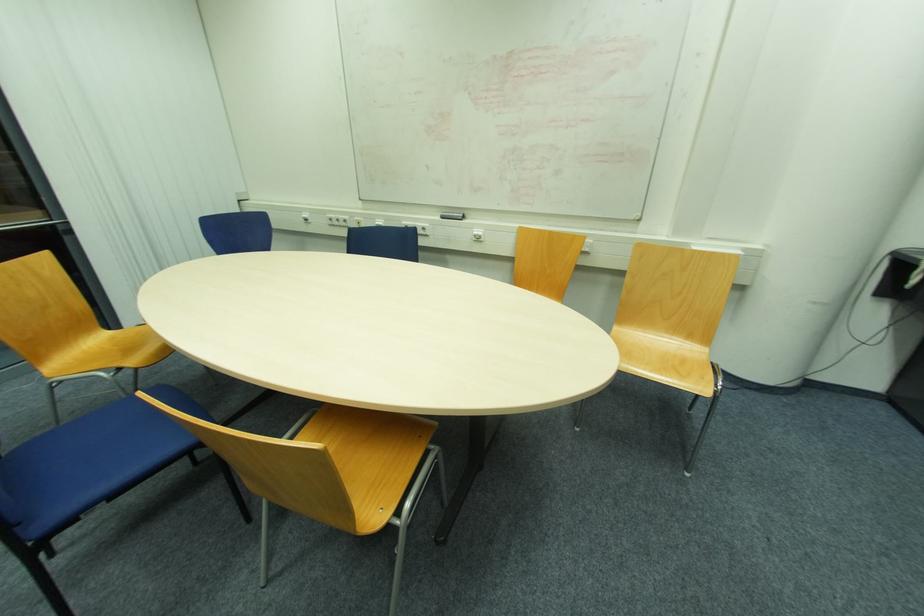
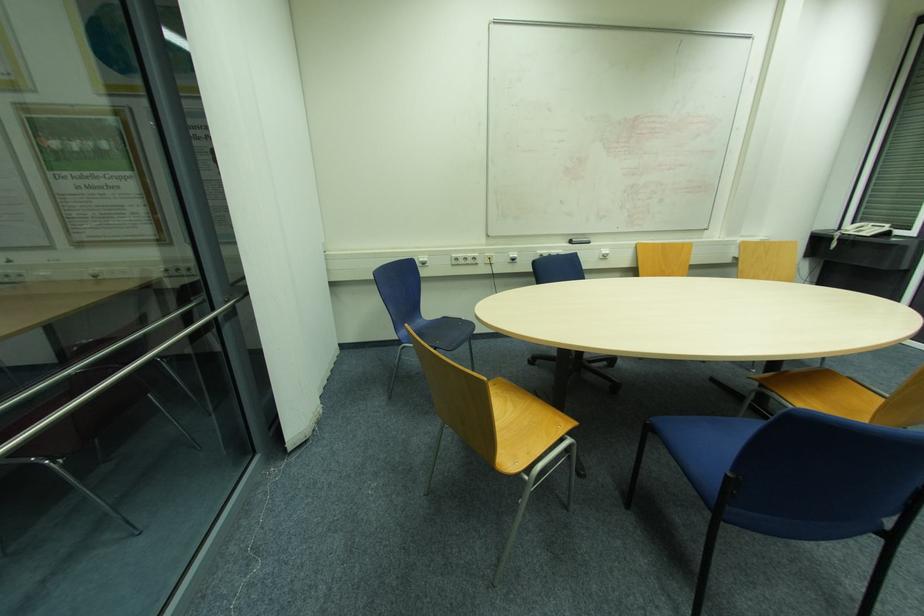
The point at (444, 217) is marked in the first image. Where is the corresponding point in the second image?

(574, 244)